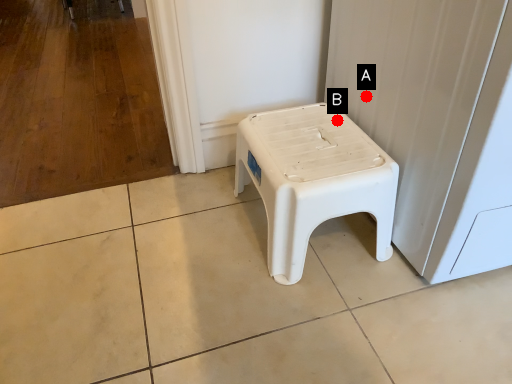
Question: Two points are circled on the image, labeled by A and B beside each circle. Which point is closer to the camera?

Choices:
 (A) A is closer
 (B) B is closer

Answer: (A)